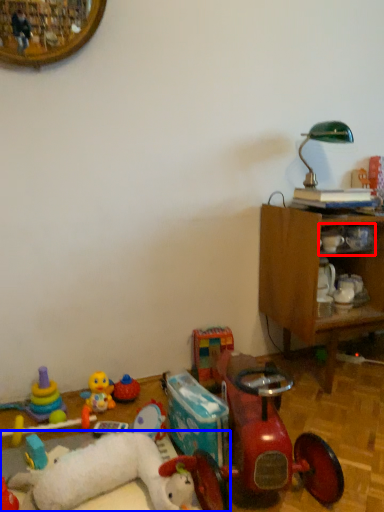
Question: Which of the following is the farthest to the observer, shelf (highlighted by a red box) or toy (highlighted by a blue box)?

Choices:
 (A) shelf
 (B) toy

Answer: (A)